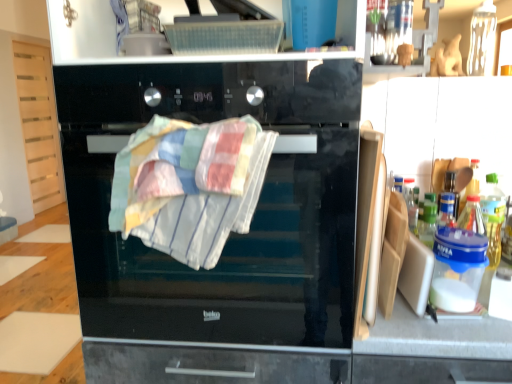
Question: Considering the positions of point (245, 183) and point (220, 289), is point (245, 183) closer or farther from the camera than point (220, 289)?

Choices:
 (A) farther
 (B) closer

Answer: (B)

Question: From a real-world perspective, is multicolored woven towel at center above or below black glass oven at center?

Choices:
 (A) below
 (B) above

Answer: (B)

Question: Which of these objects is positioned farthest from the black glass oven at center?

Choices:
 (A) multicolored woven towel at center
 (B) translucent plastic bottle at right

Answer: (B)

Question: Which is nearer to the multicolored woven towel at center?

Choices:
 (A) translucent plastic bottle at right
 (B) black glass oven at center

Answer: (B)